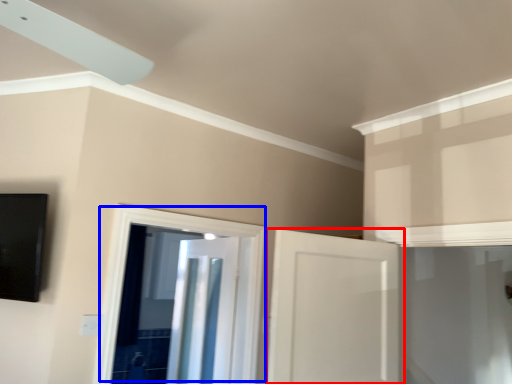
Question: Which object is closer to the camera taking this photo, door (highlighted by a red box) or door (highlighted by a blue box)?

Choices:
 (A) door
 (B) door

Answer: (A)